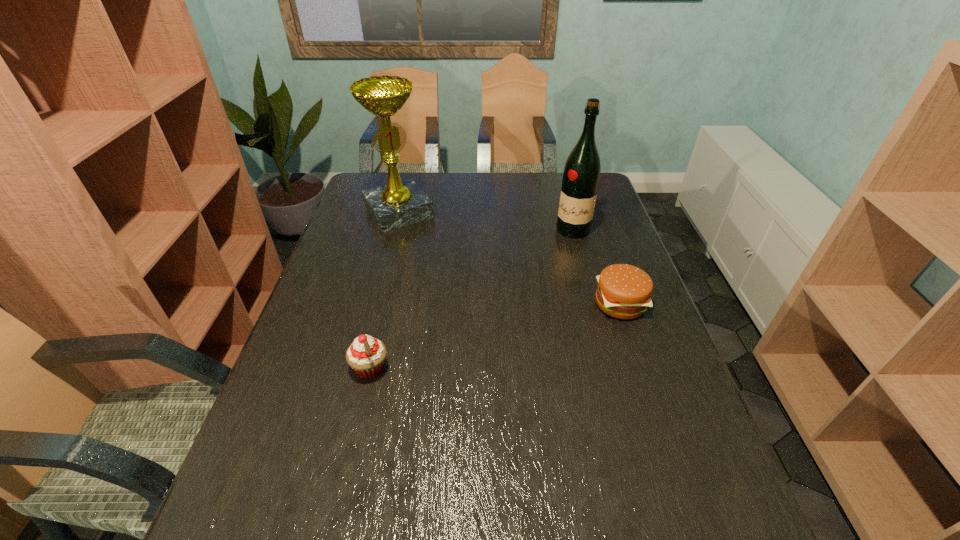
The image size is (960, 540). In the image, there is a desktop. In order to click on vacant space at the far edge in this screenshot , I will do `click(460, 184)`.

The image size is (960, 540). In order to click on vacant space at the near edge in this screenshot , I will do pyautogui.click(x=505, y=485).

Locate an element on the screen. The height and width of the screenshot is (540, 960). vacant region at the left edge of the desktop is located at coordinates (326, 275).

Locate an element on the screen. vacant space at the right edge of the desktop is located at coordinates (632, 264).

In the image, there is a desktop. What are the coordinates of `free space at the far right corner` in the screenshot? It's located at (607, 196).

Identify the location of empty space that is in between the shortest object and the nearest object. Image resolution: width=960 pixels, height=540 pixels. (494, 336).

Where is `vacant point located between the award and the hamburger`? The height and width of the screenshot is (540, 960). vacant point located between the award and the hamburger is located at coordinates (509, 258).

Image resolution: width=960 pixels, height=540 pixels. What are the coordinates of `free space between the liquor and the second nearest object` in the screenshot? It's located at (596, 267).

The width and height of the screenshot is (960, 540). I want to click on vacant space that is in between the award and the second nearest object, so click(x=509, y=258).

Where is `vacant area that lies between the award and the cupcake`? vacant area that lies between the award and the cupcake is located at coordinates (384, 290).